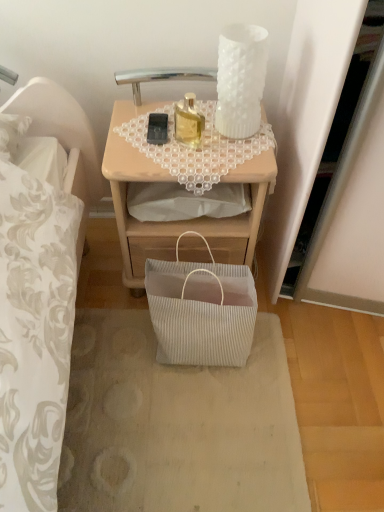
This screenshot has width=384, height=512. What are the coordinates of `free space to the left of white pleated bag at lower center` in the screenshot? It's located at (107, 364).